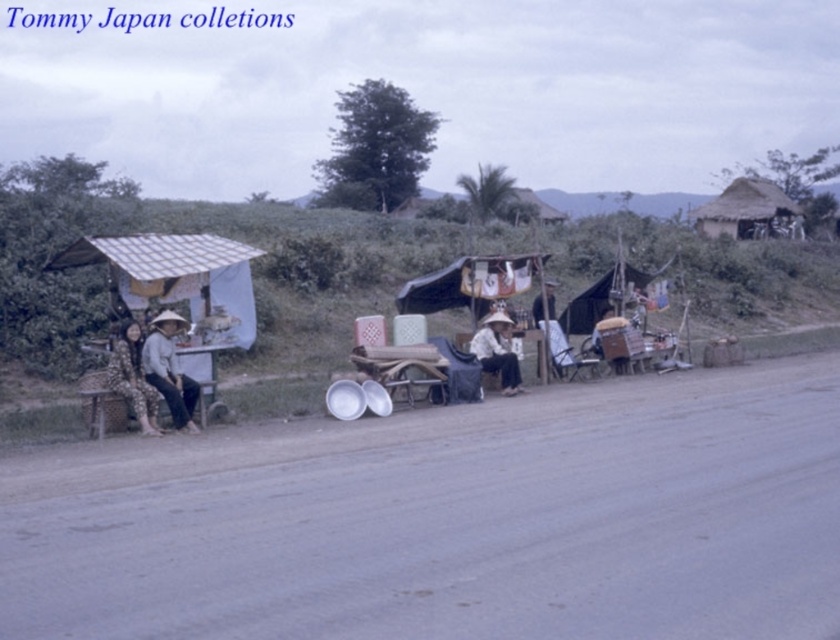
You are standing at the point with coordinates point (124, 378) and want to walk to the point with coordinates point (507, 416). Given the scene described, is there a clear path between these two points?

Point (507, 416) is behind point (124, 378), so there is no clear path between them as the latter blocks the way.